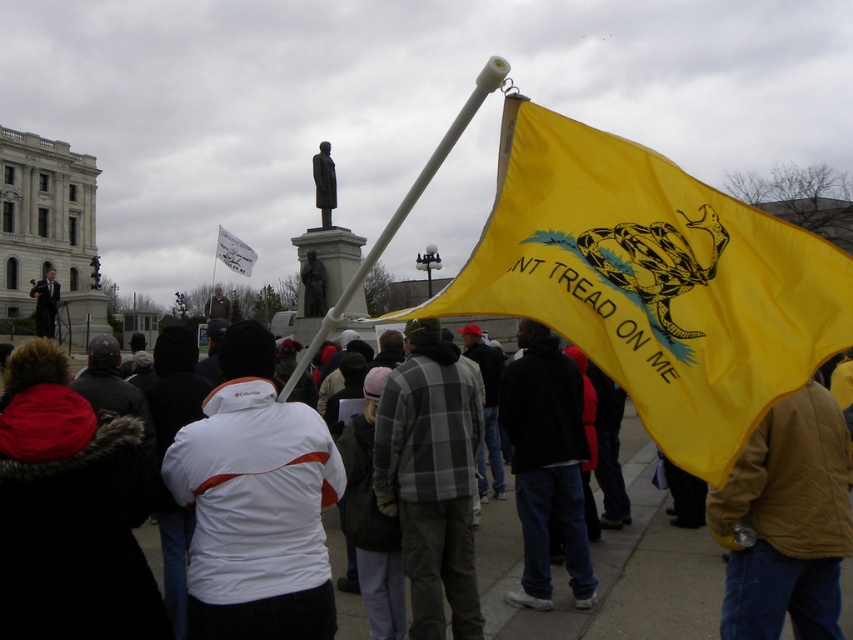
You are a photographer standing at the center of the crowd. You want to take a photo of the yellow flag with a black snake and the person holding it. However, there is an object blocking your view at point (787, 520). What object is blocking your shot?

The brown leather jacket at lower right is located at point (787, 520), so it is blocking your view of the yellow flag with a black snake and the person holding it.

You are a photographer standing at the camera position. You want to take a photo of the brown leather jacket at lower right. Is the jacket within your camera lens range if your camera can capture objects up to 150 feet away?

The brown leather jacket at lower right and camera are 143.68 feet apart, so yes, the jacket is within the camera lens range since the distance is less than 150 feet.

You are a photographer standing at the edge of the crowd. You want to capture a photo of the plaid fleece jacket at center without the white plastic flag pole at center blocking it. Is the flag pole currently blocking the jacket?

The plaid fleece jacket at center is positioned under the white plastic flag pole at center, so yes, the flag pole is currently blocking the jacket.